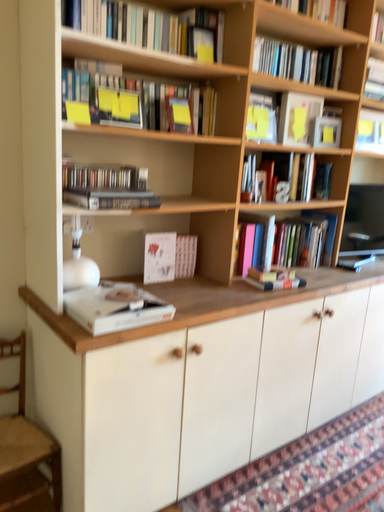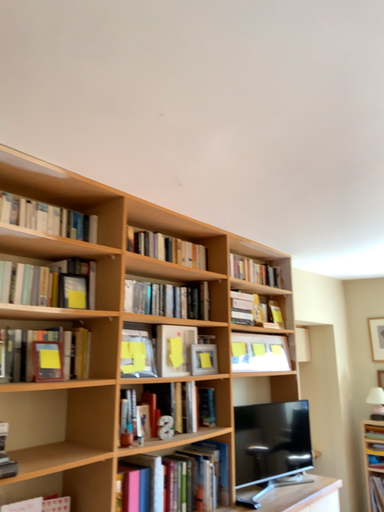
Question: Which way did the camera rotate in the video?

Choices:
 (A) rotated right
 (B) rotated left

Answer: (A)